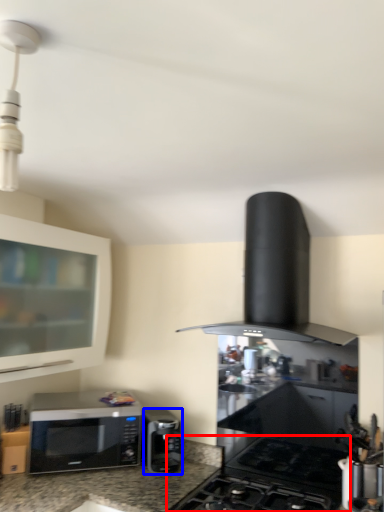
Question: Which point is closer to the camera, gas stove (highlighted by a red box) or microwave oven (highlighted by a blue box)?

Choices:
 (A) gas stove
 (B) microwave oven

Answer: (A)